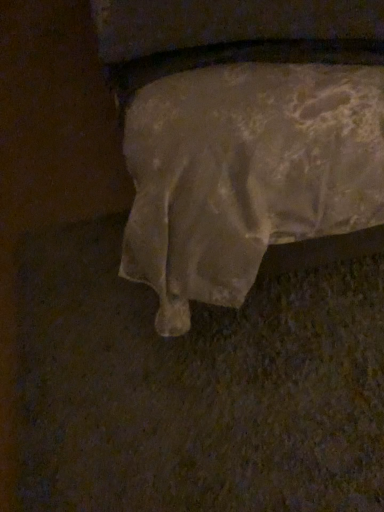
Find the location of `silky white fabric at upper right`. silky white fabric at upper right is located at coordinates (242, 135).

In order to face silky white fabric at upper right, should I rotate leftwards or rightwards?

Rotate left and turn 0.464 degrees.

What do you see at coordinates (242, 135) in the screenshot? This screenshot has height=512, width=384. I see `silky white fabric at upper right` at bounding box center [242, 135].

Locate an element on the screen. The width and height of the screenshot is (384, 512). silky white fabric at upper right is located at coordinates (242, 135).